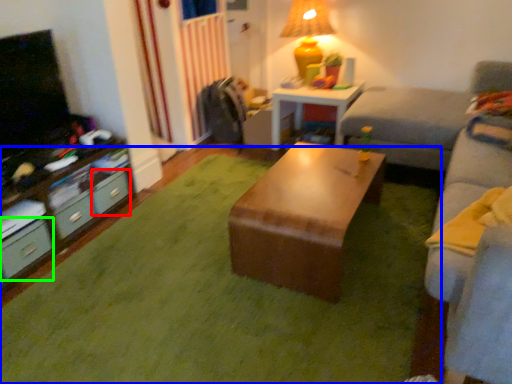
Question: Which object is positioned closest to drawer (highlighted by a red box)? Select from grass (highlighted by a blue box) and drawer (highlighted by a green box).

Choices:
 (A) grass
 (B) drawer

Answer: (B)